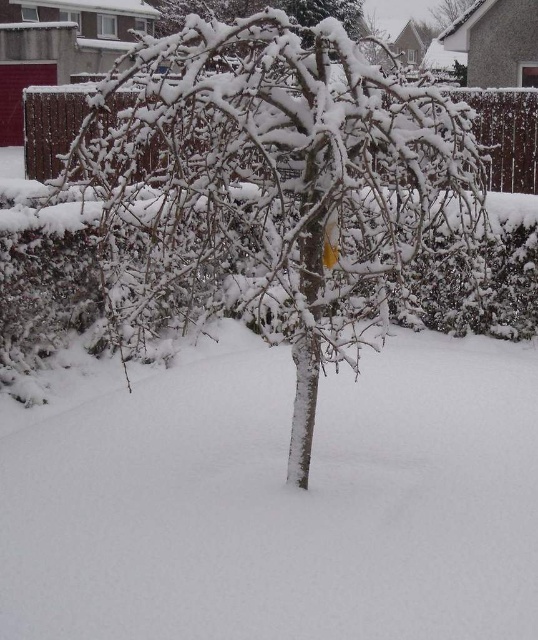
Question: Among these points, which one is nearest to the camera?

Choices:
 (A) (284, 20)
 (B) (459, 8)

Answer: (A)

Question: Which point appears closest to the camera in this image?

Choices:
 (A) (181, 300)
 (B) (444, 13)

Answer: (A)

Question: Which point appears closest to the camera in this image?

Choices:
 (A) pyautogui.click(x=430, y=12)
 (B) pyautogui.click(x=222, y=28)

Answer: (B)

Question: Is snow-covered branches at center above snow-covered tree at upper center?

Choices:
 (A) yes
 (B) no

Answer: (B)

Question: Does snow-covered branches at center appear under snow-covered tree at upper center?

Choices:
 (A) yes
 (B) no

Answer: (A)

Question: Considering the relative positions of snow-covered branches at center and snow-covered tree at upper center in the image provided, where is snow-covered branches at center located with respect to snow-covered tree at upper center?

Choices:
 (A) below
 (B) above

Answer: (A)